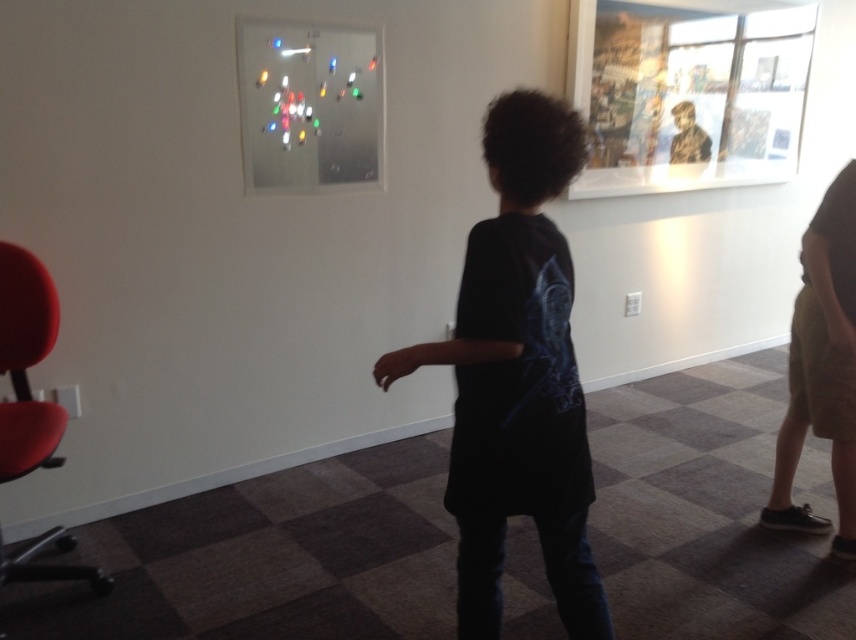
Is point (515, 372) closer to camera compared to point (777, 51)?

Yes, point (515, 372) is closer to viewer.

Does point (520, 90) come in front of point (596, 176)?

Yes.

Where is `dark blue t-shirt at center`? This screenshot has height=640, width=856. dark blue t-shirt at center is located at coordinates (516, 376).

Is dark blue t-shirt at center positioned in front of matte red swivel chair at left?

Yes, it is in front of matte red swivel chair at left.

Does dark blue t-shirt at center have a greater height compared to matte red swivel chair at left?

Indeed, dark blue t-shirt at center has a greater height compared to matte red swivel chair at left.

Who is more distant from viewer, [470,483] or [7,576]?

Point [7,576]

Find the location of a particular element. dark blue t-shirt at center is located at coordinates (516, 376).

Does camouflage fabric poster at upper right appear on the right side of matte red swivel chair at left?

Yes, camouflage fabric poster at upper right is to the right of matte red swivel chair at left.

Does point (682, 109) come farther from viewer compared to point (34, 548)?

Yes, it is behind point (34, 548).

Locate an element on the screen. camouflage fabric poster at upper right is located at coordinates (690, 99).